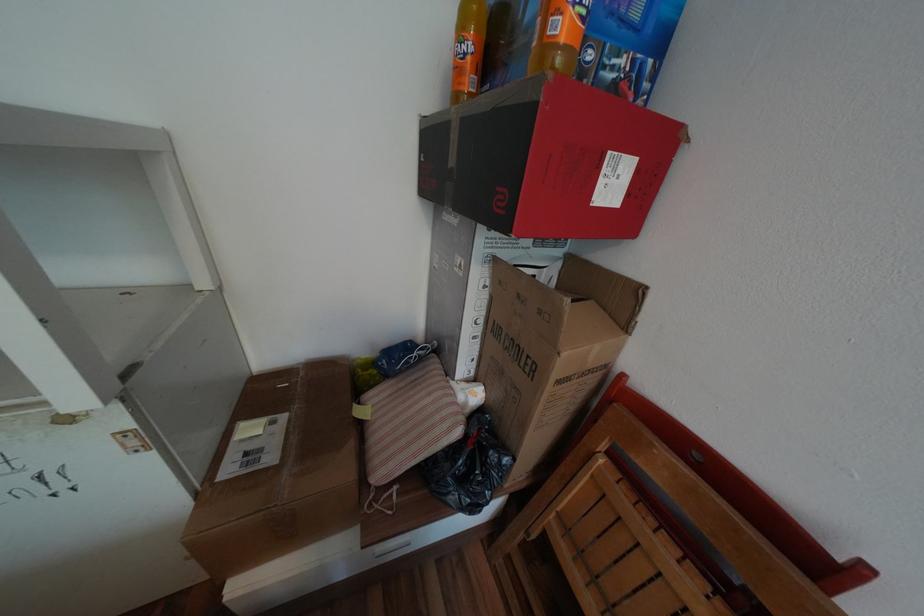
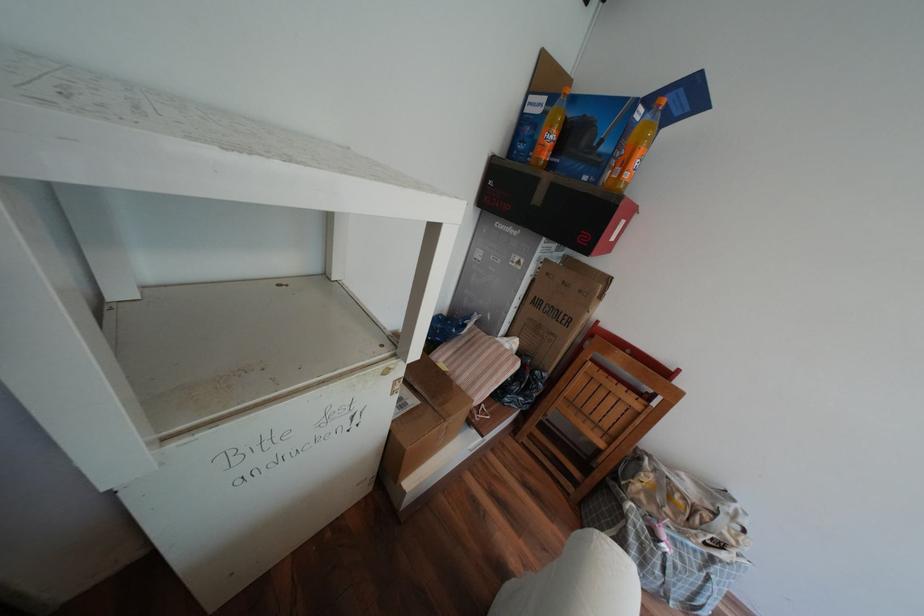
Find the pixel in the second image that matches pixel 550 312 in the first image.

(590, 291)